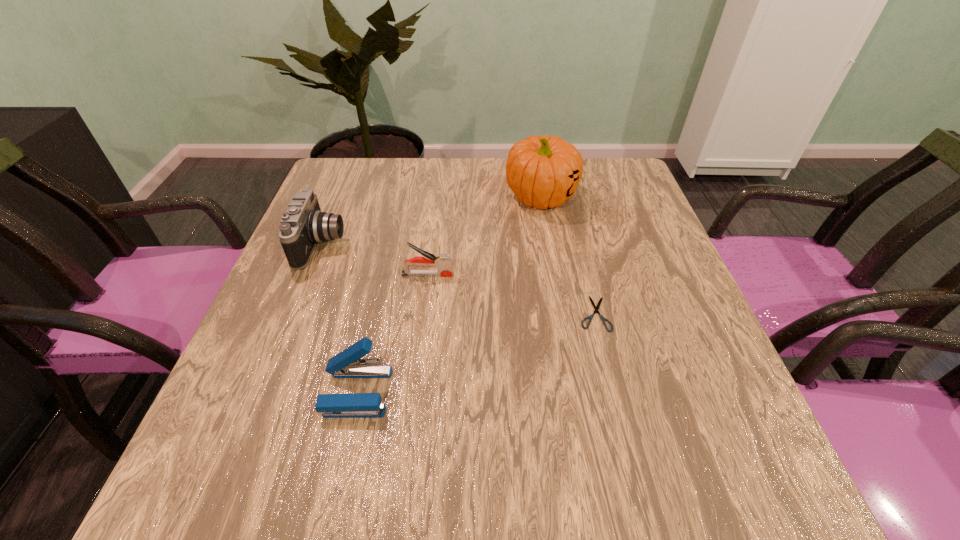
Locate an element on the screen. This screenshot has height=540, width=960. the farthest object is located at coordinates (544, 171).

Identify the location of the tallest object. (544, 171).

Find the location of a particular element. Image resolution: width=960 pixels, height=540 pixels. camera is located at coordinates (303, 225).

This screenshot has height=540, width=960. I want to click on the fourth shortest object, so click(303, 225).

Locate an element on the screen. This screenshot has height=540, width=960. the farther stapler is located at coordinates (442, 262).

Image resolution: width=960 pixels, height=540 pixels. I want to click on the nearer stapler, so click(x=343, y=365).

Locate an element on the screen. The image size is (960, 540). the shortest object is located at coordinates (596, 308).

The height and width of the screenshot is (540, 960). What are the coordinates of `shears` in the screenshot? It's located at (596, 308).

This screenshot has width=960, height=540. In order to click on vacant space situated on the surface of the pumpkin in this screenshot , I will do `click(548, 234)`.

Where is `vacant space located 0.400m on the front-facing side of the camera`? The width and height of the screenshot is (960, 540). vacant space located 0.400m on the front-facing side of the camera is located at coordinates (512, 245).